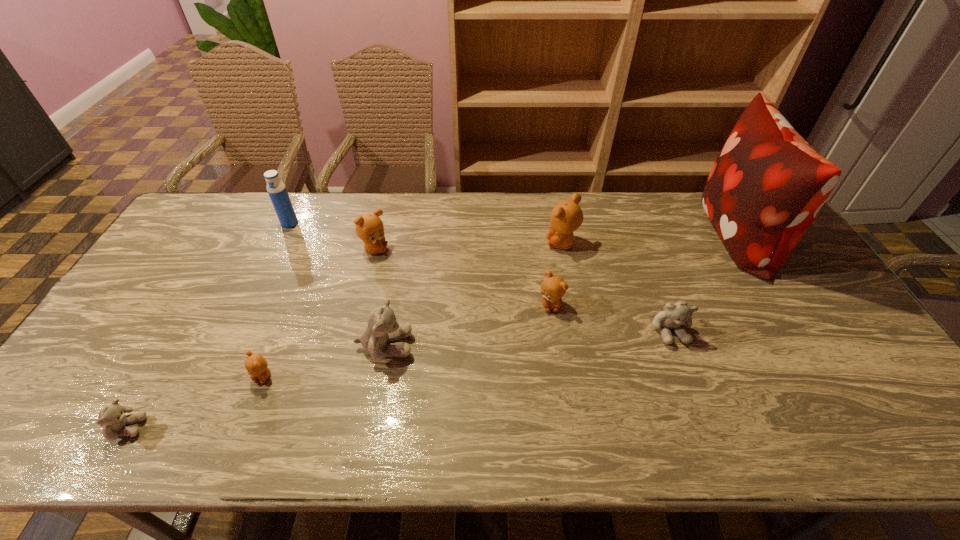
Find the location of a particular element. free space that satisfies the following two spatial constraints: 1. on the front-facing side of the cushion; 2. on the face of the rightmost teddy bear is located at coordinates (795, 329).

Find the location of a particular element. The height and width of the screenshot is (540, 960). vacant region that satisfies the following two spatial constraints: 1. on the face of the third biggest brown teddy bear; 2. on the face of the biggest gray teddy bear is located at coordinates tap(557, 346).